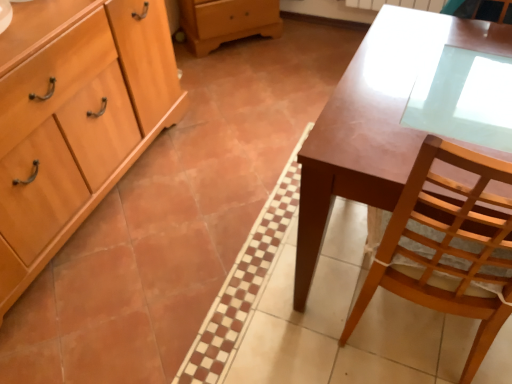
Question: Relative to light wood cabinet at left, is matte brown desk at center in front or behind?

Choices:
 (A) behind
 (B) front

Answer: (B)

Question: From the image's perspective, is matte brown desk at center positioned above or below light wood cabinet at left?

Choices:
 (A) above
 (B) below

Answer: (B)

Question: Would you say matte brown desk at center is to the left or to the right of light wood cabinet at left in the picture?

Choices:
 (A) left
 (B) right

Answer: (B)

Question: Would you say light wood cabinet at left is to the left or to the right of matte brown desk at center in the picture?

Choices:
 (A) left
 (B) right

Answer: (A)

Question: From a real-world perspective, is light wood cabinet at left above or below matte brown desk at center?

Choices:
 (A) above
 (B) below

Answer: (A)

Question: In the image, is light wood cabinet at left positioned in front of or behind matte brown desk at center?

Choices:
 (A) front
 (B) behind

Answer: (B)

Question: Is light wood cabinet at left inside the boundaries of matte brown desk at center, or outside?

Choices:
 (A) outside
 (B) inside

Answer: (A)